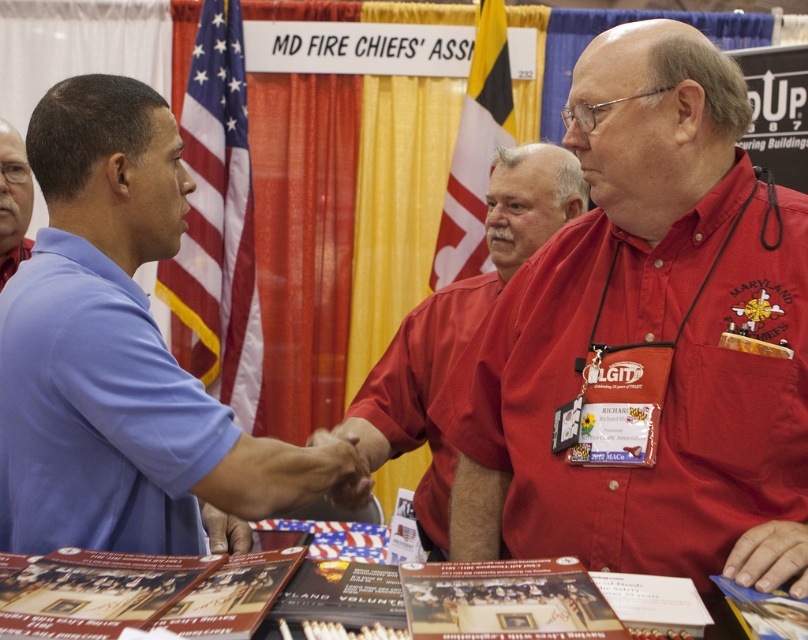
Question: Considering the real-world distances, which object is farthest from the american flag at left?

Choices:
 (A) blue shirt at left
 (B) yellow fabric flag at upper center
 (C) matte red shirt at center
 (D) smooth red shirt at lower right

Answer: (D)

Question: Which object appears farthest from the camera in this image?

Choices:
 (A) american flag at left
 (B) smooth skin hand at center
 (C) dark brown leather hand at center
 (D) blue shirt at left

Answer: (A)

Question: Estimate the real-world distances between objects in this image. Which object is closer to the matte blue polo at left?

Choices:
 (A) smooth red shirt at lower right
 (B) dark brown leather hand at center
 (C) red smooth shirt at center

Answer: (B)

Question: Can you confirm if blue shirt at left is positioned below dark brown leather hand at center?

Choices:
 (A) yes
 (B) no

Answer: (B)

Question: Where is american flag at left located in relation to blue shirt at left in the image?

Choices:
 (A) right
 (B) left

Answer: (A)

Question: Does blue cotton shirt at center appear on the left side of smooth skin hand at center?

Choices:
 (A) yes
 (B) no

Answer: (A)